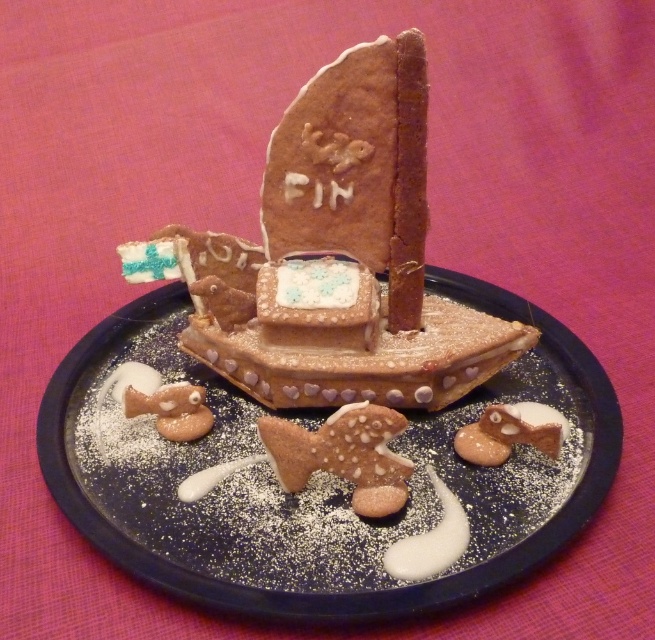
You are a chef who wants to place a new chocolate cookie boat at center on the dark blue plate at center. Is there enough space between them to do this?

The dark blue plate at center is 7.70 inches away from the chocolate cookie boat at center, so there is sufficient space to place the new chocolate cookie boat at center on the dark blue plate at center.

You are a food critic inspecting the edible sailboat display. You need to describe the position of the dark blue plate at center relative to the chocolate cookie boat at center without mentioning their exact locations. How would you phrase this?

The dark blue plate at center is positioned to the left of the chocolate cookie boat at center.

You are a food stylist arranging this edible sailboat scene. You need to ensure that the chocolate cookie boat at center doesn not block the view of the glazed brown fish at center from the front. Is the current arrangement okay?

The chocolate cookie boat at center is positioned over the glazed brown fish at center, so it is blocking the view of the fish. You need to adjust the arrangement to move the chocolate cookie boat at center away from the glazed brown fish at center so the fish is visible.